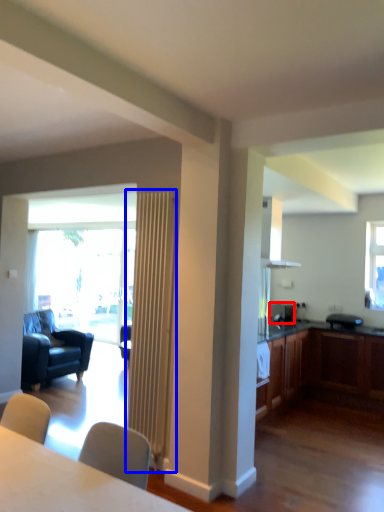
Question: Which object is further to the camera taking this photo, appliance (highlighted by a red box) or radiator (highlighted by a blue box)?

Choices:
 (A) appliance
 (B) radiator

Answer: (A)